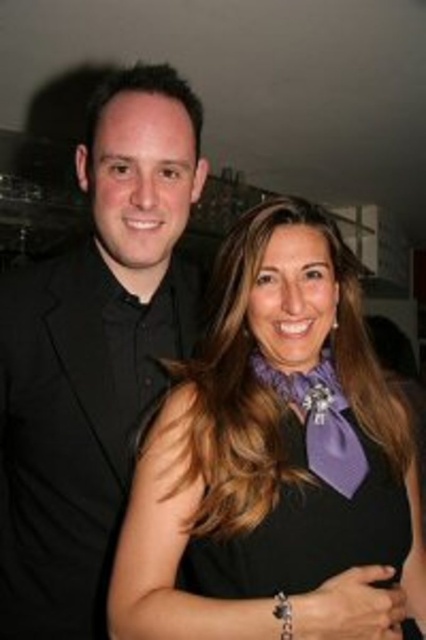
Question: Which object is farther from the camera taking this photo?

Choices:
 (A) purple satin scarf at center
 (B) purple satin dress at center
 (C) black matte suit at left

Answer: (C)

Question: Estimate the real-world distances between objects in this image. Which object is closer to the black matte suit at left?

Choices:
 (A) purple satin dress at center
 (B) purple satin scarf at center
 (C) purple satin tie at center

Answer: (B)

Question: Where is purple satin scarf at center located in relation to purple satin dress at center in the image?

Choices:
 (A) right
 (B) left

Answer: (A)

Question: Can you confirm if purple satin dress at center is positioned below purple satin tie at center?

Choices:
 (A) yes
 (B) no

Answer: (A)

Question: Is purple satin scarf at center wider than purple satin tie at center?

Choices:
 (A) no
 (B) yes

Answer: (B)

Question: Which point is farther to the camera?

Choices:
 (A) (26, 548)
 (B) (276, 529)
 (C) (276, 612)
 (D) (322, 404)

Answer: (A)